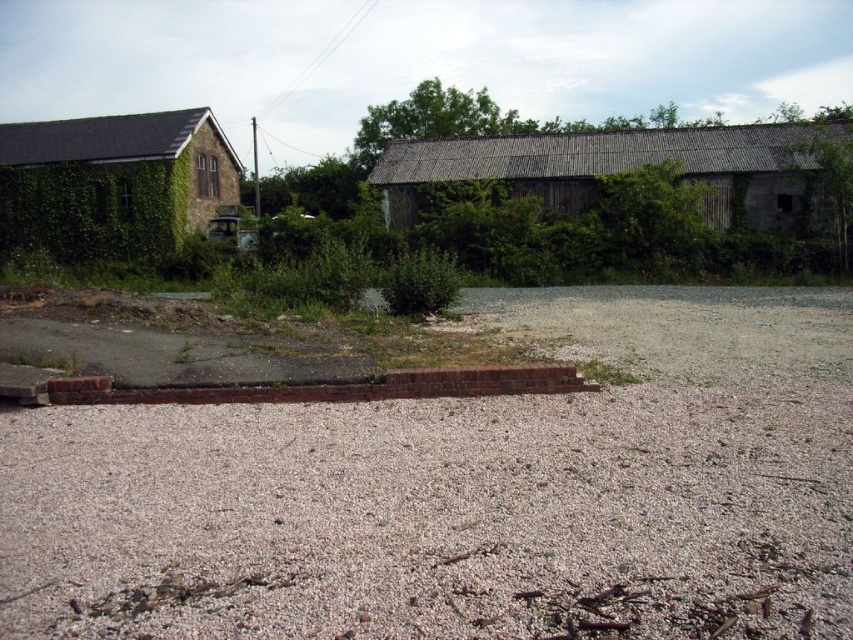
Is gray gravel at center smaller than green leafy bush at center?

Yes, gray gravel at center is smaller than green leafy bush at center.

Is gray gravel at center positioned before green leafy bush at center?

Yes, it is in front of green leafy bush at center.

Does point (778, 444) come behind point (437, 280)?

No, (778, 444) is in front of (437, 280).

Where is `gray gravel at center`? The height and width of the screenshot is (640, 853). gray gravel at center is located at coordinates (425, 513).